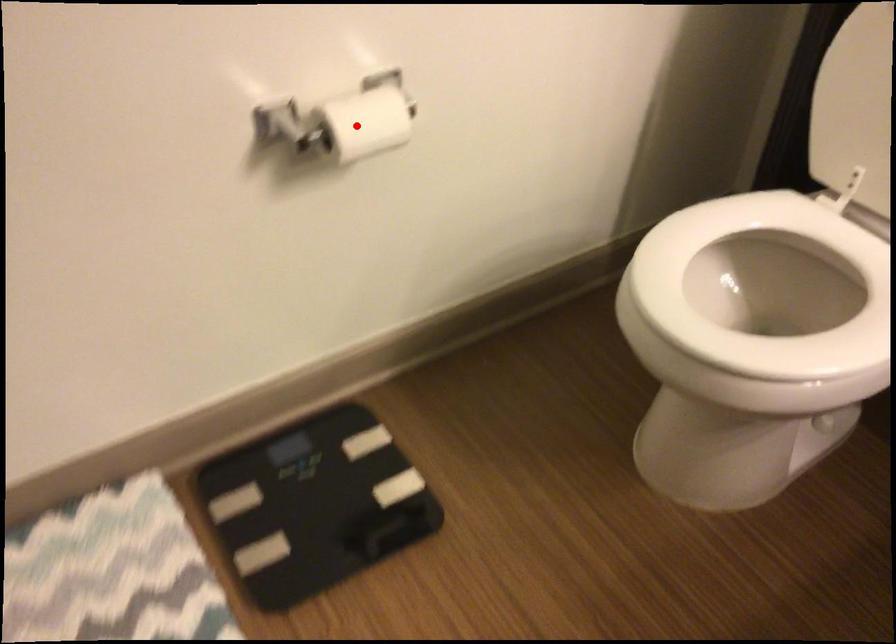
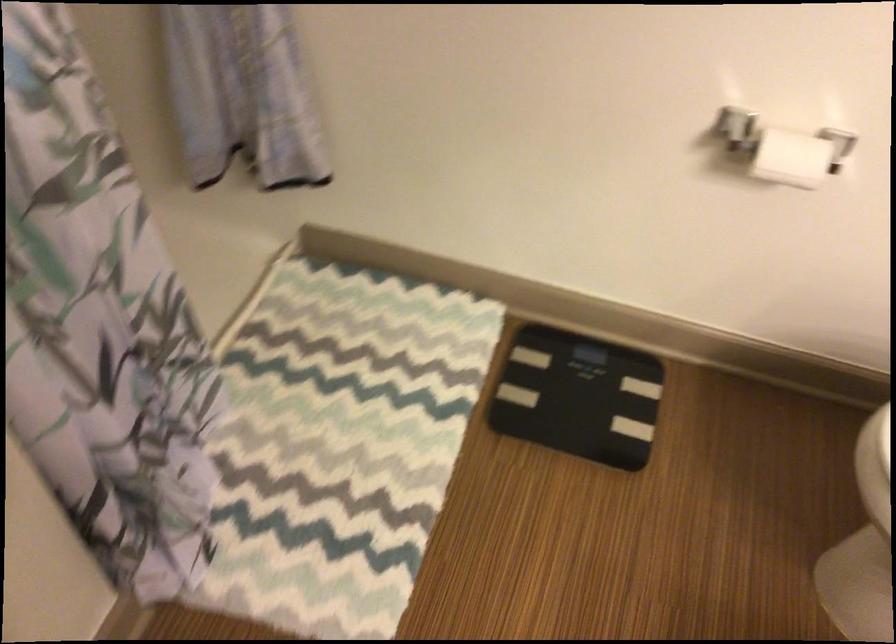
Question: I am providing you with two images of the same scene from different viewpoints. Image1 has a red point marked. In image2, the corresponding 3D location appears at what relative position? Reply with the corresponding letter.

Choices:
 (A) Closer
 (B) Farther

Answer: (B)